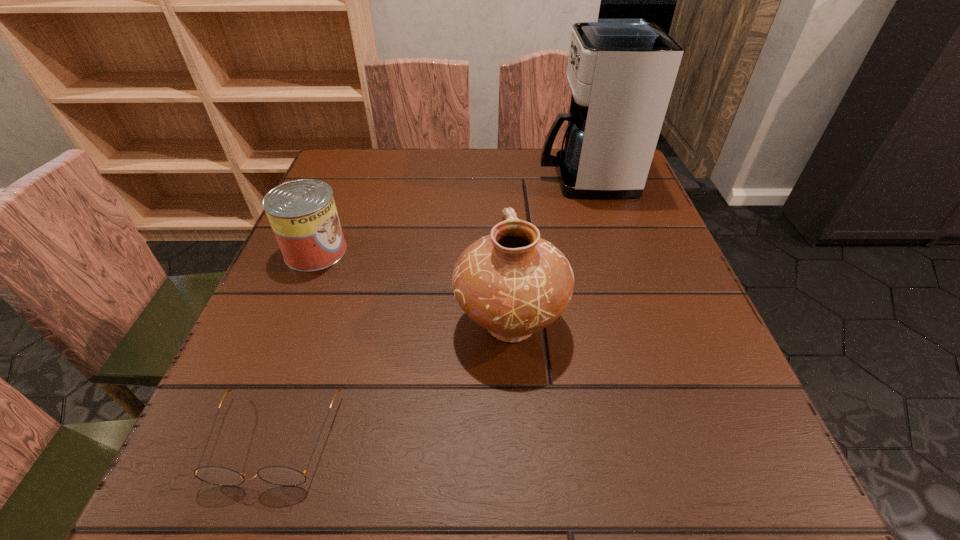
The image size is (960, 540). I want to click on vacant space in between the third object from left to right and the nearest object, so click(393, 381).

Find the location of a particular element. vacant space that's between the spectacles and the tallest object is located at coordinates (430, 309).

At what (x,y) coordinates should I click in order to perform the action: click on free spot between the third tallest object and the spectacles. Please return your answer as a coordinate pair (x, y). Looking at the image, I should click on (296, 346).

Where is `empty space between the nearest object and the third shortest object`? empty space between the nearest object and the third shortest object is located at coordinates pyautogui.click(x=393, y=381).

The image size is (960, 540). Identify the location of free point between the third nearest object and the spectacles. (296, 346).

This screenshot has width=960, height=540. In order to click on free space between the can and the rightmost object in this screenshot , I will do `click(450, 215)`.

This screenshot has height=540, width=960. Identify the location of empty space between the third shortest object and the second shortest object. (413, 287).

I want to click on empty space between the spectacles and the second farthest object, so click(296, 346).

Identify the location of the third closest object relative to the shortest object. The width and height of the screenshot is (960, 540). (621, 72).

Identify the location of the second closest object to the tallest object. (302, 213).